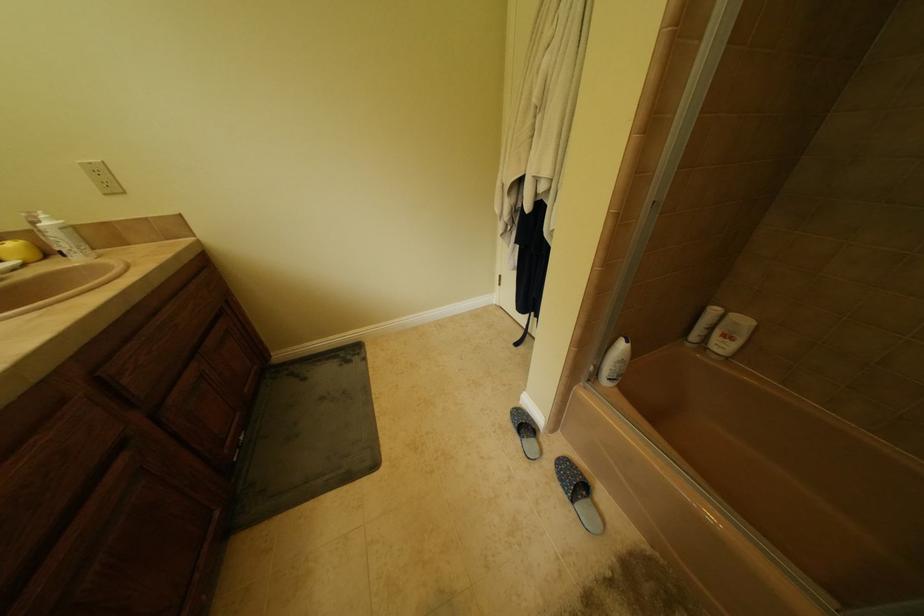
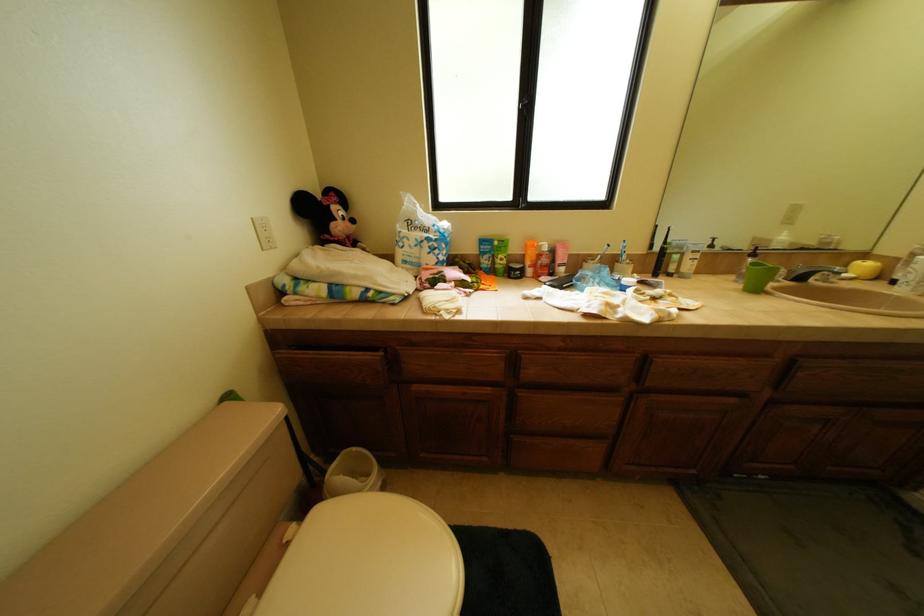
The images are taken continuously from a first-person perspective. In which direction is your viewpoint rotating?

The camera rotated toward left-down.